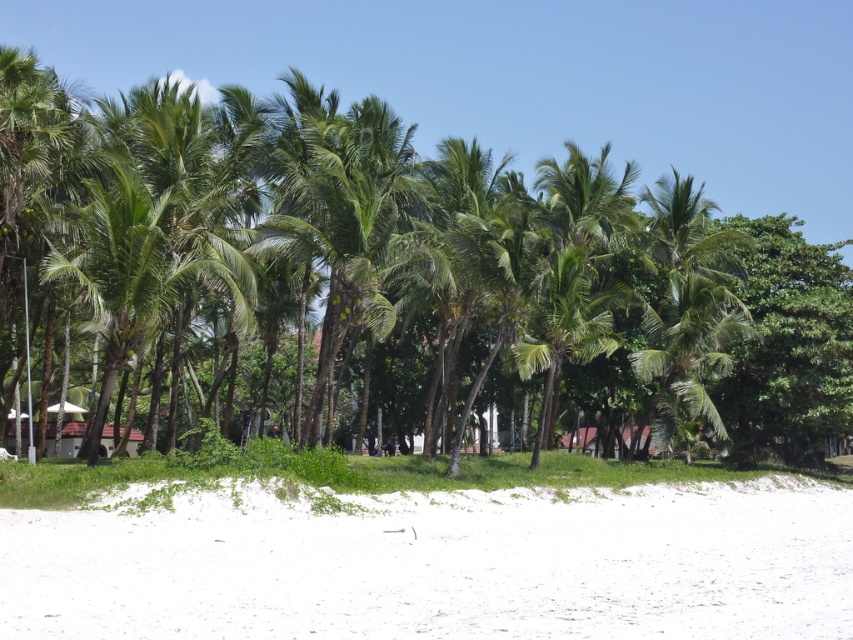
Is white sandy beach at lower center to the right of green leafy palm tree at center from the viewer's perspective?

Incorrect, white sandy beach at lower center is not on the right side of green leafy palm tree at center.

Based on the photo, between white sandy beach at lower center and green leafy palm tree at center, which one has more height?

white sandy beach at lower center

Where is `white sandy beach at lower center`? The image size is (853, 640). white sandy beach at lower center is located at coordinates (434, 563).

Between green leafy palm tree at left and green leafy palm tree at center, which one has less height?

green leafy palm tree at center

Who is more distant from viewer, (57, 266) or (735, 330)?

Point (735, 330)

Where is `green leafy palm tree at left`? green leafy palm tree at left is located at coordinates (119, 275).

This screenshot has width=853, height=640. What do you see at coordinates (434, 563) in the screenshot?
I see `white sandy beach at lower center` at bounding box center [434, 563].

Does point (358, 616) lie behind point (86, 259)?

That is False.

Who is more forward, (399, 572) or (122, 257)?

Positioned in front is point (399, 572).

Image resolution: width=853 pixels, height=640 pixels. In order to click on white sandy beach at lower center in this screenshot , I will do point(434,563).